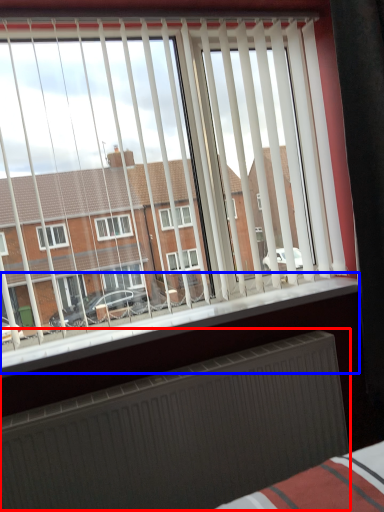
Question: Which point is further to the camera, radiator (highlighted by a red box) or window sill (highlighted by a blue box)?

Choices:
 (A) radiator
 (B) window sill

Answer: (B)